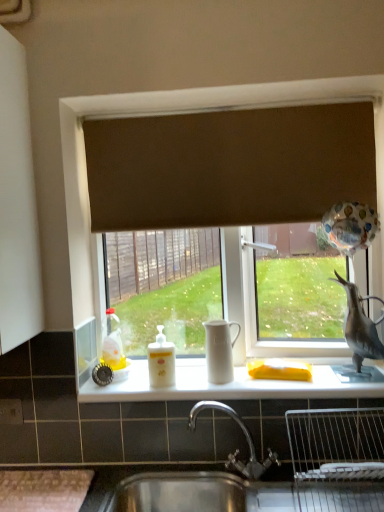
Question: Is brown fabric curtain at upper center positioned with its back to white matte tea pot at center?

Choices:
 (A) no
 (B) yes

Answer: (A)

Question: Does brown fabric curtain at upper center have a larger size compared to white matte tea pot at center?

Choices:
 (A) no
 (B) yes

Answer: (B)

Question: Is brown fabric curtain at upper center at the right side of white matte tea pot at center?

Choices:
 (A) no
 (B) yes

Answer: (B)

Question: From the image's perspective, is brown fabric curtain at upper center beneath white matte tea pot at center?

Choices:
 (A) no
 (B) yes

Answer: (A)

Question: Does brown fabric curtain at upper center come behind white matte tea pot at center?

Choices:
 (A) yes
 (B) no

Answer: (A)

Question: Does point (220, 359) appear closer or farther from the camera than point (114, 369)?

Choices:
 (A) closer
 (B) farther

Answer: (A)

Question: Looking at their shapes, would you say white matte tea pot at center is wider or thinner than translucent plastic bottle at left?

Choices:
 (A) thin
 (B) wide

Answer: (B)

Question: Based on their positions, is white matte tea pot at center located to the left or right of translucent plastic bottle at left?

Choices:
 (A) right
 (B) left

Answer: (A)

Question: From the image's perspective, relative to translucent plastic bottle at left, is white matte tea pot at center above or below?

Choices:
 (A) below
 (B) above

Answer: (A)

Question: Is translucent plastic bottle at left situated inside gray matte bird at right or outside?

Choices:
 (A) inside
 (B) outside

Answer: (B)

Question: From their relative heights in the image, would you say translucent plastic bottle at left is taller or shorter than gray matte bird at right?

Choices:
 (A) tall
 (B) short

Answer: (B)

Question: Looking at the image, does translucent plastic bottle at left seem bigger or smaller compared to gray matte bird at right?

Choices:
 (A) small
 (B) big

Answer: (A)

Question: From a real-world perspective, is translucent plastic bottle at left physically located above or below gray matte bird at right?

Choices:
 (A) below
 (B) above

Answer: (A)

Question: Considering their positions, is gray matte bird at right located in front of or behind translucent plastic bottle at left?

Choices:
 (A) behind
 (B) front

Answer: (B)

Question: Is gray matte bird at right taller or shorter than translucent plastic bottle at left?

Choices:
 (A) tall
 (B) short

Answer: (A)